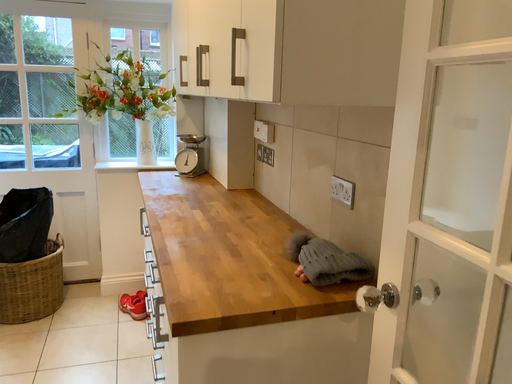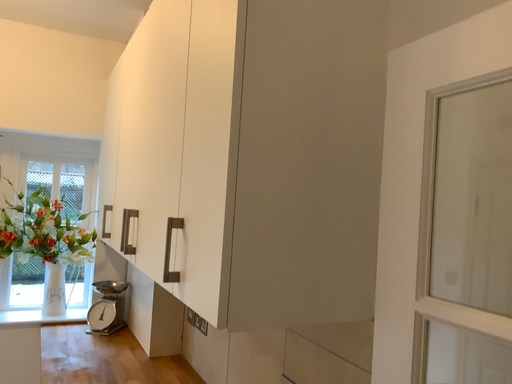
Question: How did the camera likely rotate when shooting the video?

Choices:
 (A) rotated upward
 (B) rotated downward

Answer: (A)